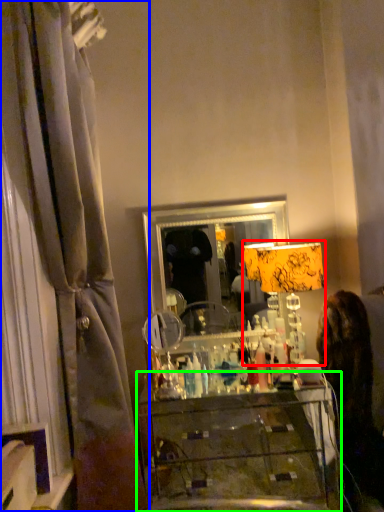
Question: Which is farther away from table lamp (highlighted by a red box)? curtain (highlighted by a blue box) or furniture (highlighted by a green box)?

Choices:
 (A) curtain
 (B) furniture

Answer: (A)